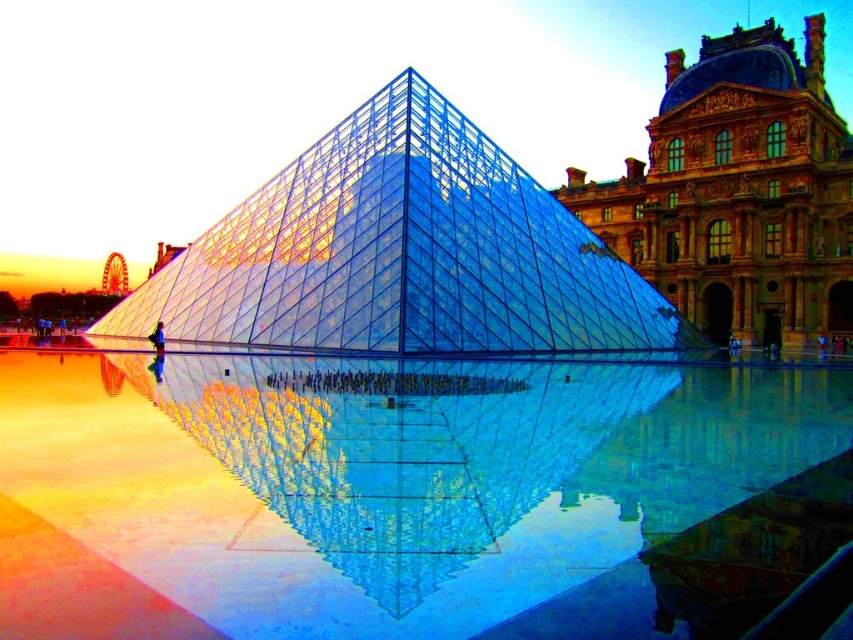
The width and height of the screenshot is (853, 640). Describe the element at coordinates (403, 253) in the screenshot. I see `transparent glass pyramid at center` at that location.

Does point (573, 248) come farther from viewer compared to point (776, 294)?

Yes, point (573, 248) is farther from viewer.

What are the coordinates of `transparent glass pyramid at center` in the screenshot? It's located at (403, 253).

Describe the element at coordinates (410, 497) in the screenshot. This screenshot has height=640, width=853. I see `transparent glass pool at center` at that location.

The height and width of the screenshot is (640, 853). In order to click on transparent glass pool at center in this screenshot , I will do `click(410, 497)`.

Is point (532, 417) positioned after point (808, 211)?

That is False.

Locate an element on the screen. Image resolution: width=853 pixels, height=640 pixels. transparent glass pool at center is located at coordinates (410, 497).

Is transparent glass pool at center to the right of transparent glass pyramid at center from the viewer's perspective?

Indeed, transparent glass pool at center is positioned on the right side of transparent glass pyramid at center.

Does transparent glass pool at center have a larger size compared to transparent glass pyramid at center?

Correct, transparent glass pool at center is larger in size than transparent glass pyramid at center.

The width and height of the screenshot is (853, 640). What do you see at coordinates (410, 497) in the screenshot?
I see `transparent glass pool at center` at bounding box center [410, 497].

This screenshot has height=640, width=853. What are the coordinates of `transparent glass pool at center` in the screenshot? It's located at point(410,497).